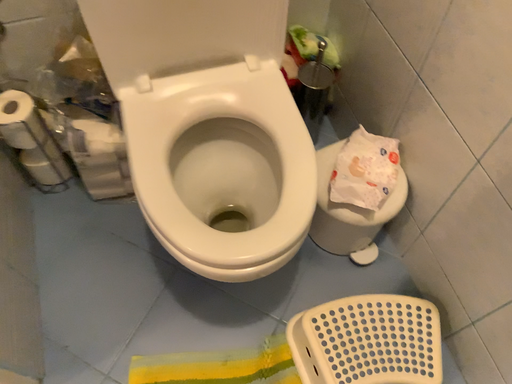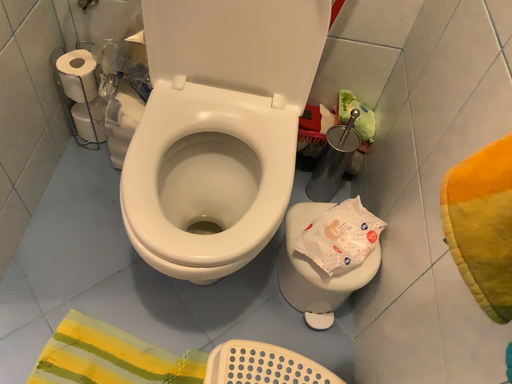
Question: Which way did the camera rotate in the video?

Choices:
 (A) rotated downward
 (B) rotated upward

Answer: (B)